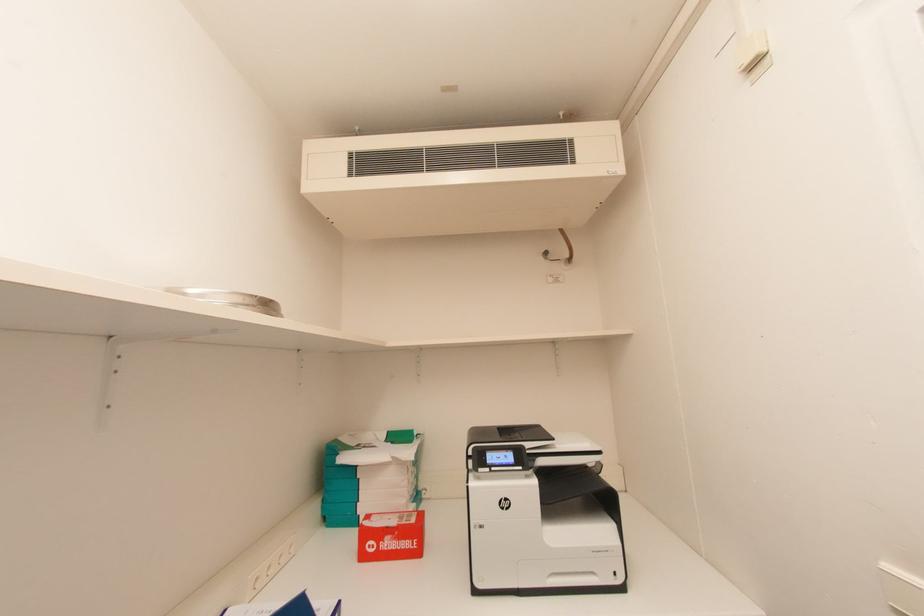
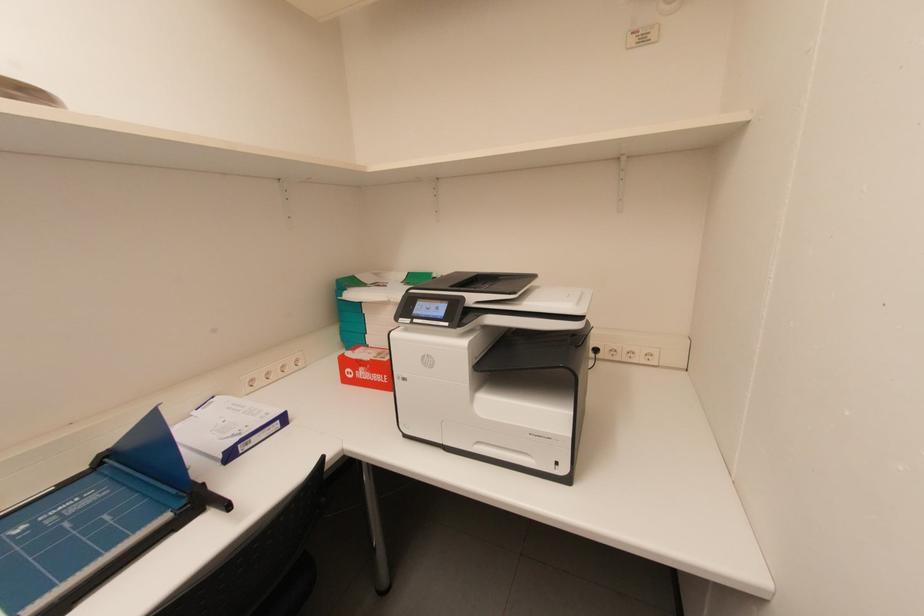
The first image is from the beginning of the video and the second image is from the end. How did the camera likely rotate when shooting the video?

The rotation direction of the camera is left-down.